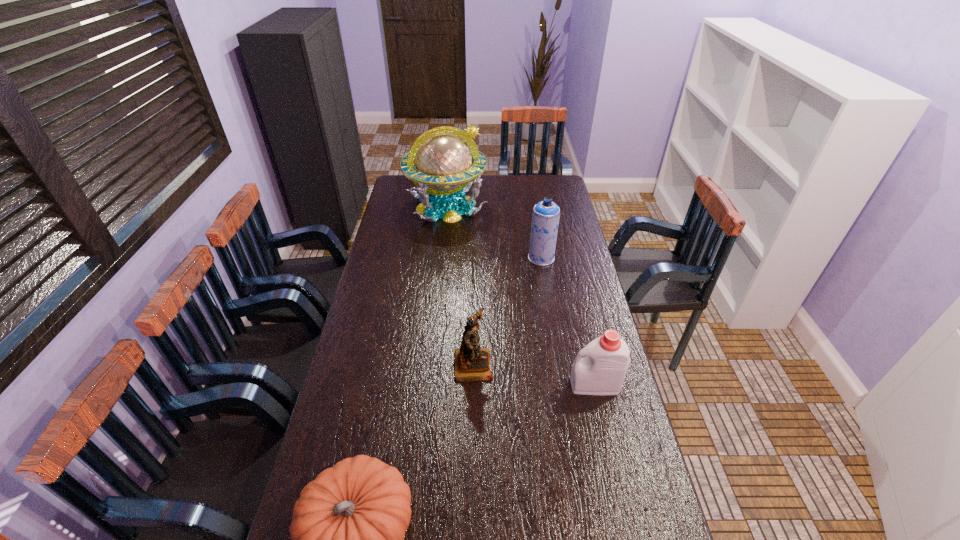
Image resolution: width=960 pixels, height=540 pixels. In order to click on unoccupied area between the detergent and the farthest object in this screenshot , I will do click(x=520, y=295).

Locate an element on the screen. vacant area between the detergent and the figurine is located at coordinates (534, 374).

The width and height of the screenshot is (960, 540). Identify the location of free spot between the figurine and the detergent. (534, 374).

Image resolution: width=960 pixels, height=540 pixels. What are the coordinates of `the third closest object to the tallest object` in the screenshot? It's located at (602, 371).

The height and width of the screenshot is (540, 960). In order to click on object that is the second closest one to the nearest object in this screenshot , I will do `click(602, 371)`.